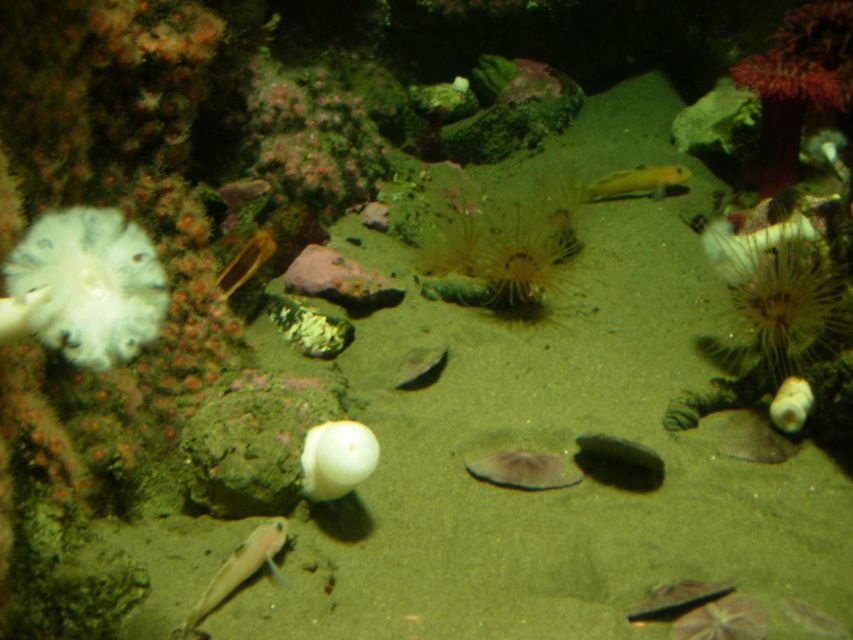
You are a marine biologist observing an underwater scene. You need to locate the translucent white sea anemone at upper right. What are its coordinates?

The translucent white sea anemone at upper right is located at coordinates point (749, 243).

You are an underwater photographer aiming to capture both the translucent pink fish at lower left and the shiny silver fish at lower center in a single frame. Based on their sizes, which fish would require more space in the camera frame to avoid cropping?

The shiny silver fish at lower center requires more space in the camera frame because it has a greater width than the translucent pink fish at lower left.

You are a marine biologist observing this underwater scene. You notice the white soft coral at left and the shiny silver fish at lower center. Which of these two objects is bigger in size?

The white soft coral at left has a larger size compared to the shiny silver fish at lower center, so the white soft coral at left is bigger.